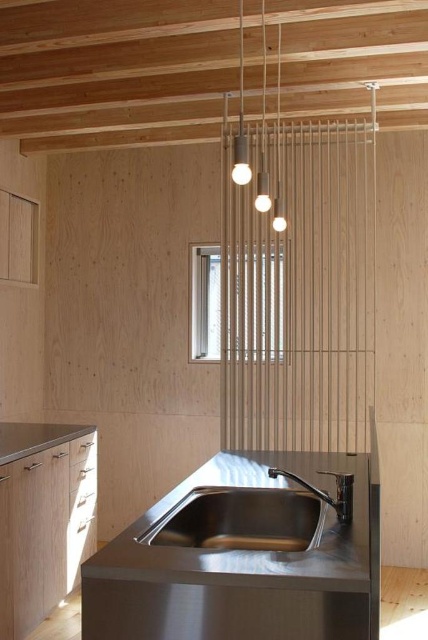
Does stainless steel sink at center have a greater width compared to stainless steel sink at lower left?

Incorrect, stainless steel sink at center's width does not surpass stainless steel sink at lower left's.

Who is shorter, stainless steel sink at center or stainless steel sink at lower left?

stainless steel sink at lower left is shorter.

At what (x,y) coordinates should I click in order to perform the action: click on stainless steel sink at center. Please return your answer as a coordinate pair (x, y). The width and height of the screenshot is (428, 640). Looking at the image, I should click on (243, 520).

Who is positioned more to the right, matte wood exhaust hood at upper center or stainless steel sink at center?

stainless steel sink at center

Is matte wood exhaust hood at upper center to the right of stainless steel sink at center from the viewer's perspective?

Incorrect, matte wood exhaust hood at upper center is not on the right side of stainless steel sink at center.

The image size is (428, 640). What do you see at coordinates (115, 68) in the screenshot?
I see `matte wood exhaust hood at upper center` at bounding box center [115, 68].

Where is `matte wood exhaust hood at upper center`? matte wood exhaust hood at upper center is located at coordinates (115, 68).

Does stainless steel sink at lower left appear on the left side of satin nickel faucet at lower center?

Correct, you'll find stainless steel sink at lower left to the left of satin nickel faucet at lower center.

Is point (58, 440) farther from camera compared to point (335, 506)?

Yes.

Describe the element at coordinates (35, 436) in the screenshot. The image size is (428, 640). I see `stainless steel sink at lower left` at that location.

Locate an element on the screen. The height and width of the screenshot is (640, 428). stainless steel sink at lower left is located at coordinates (35, 436).